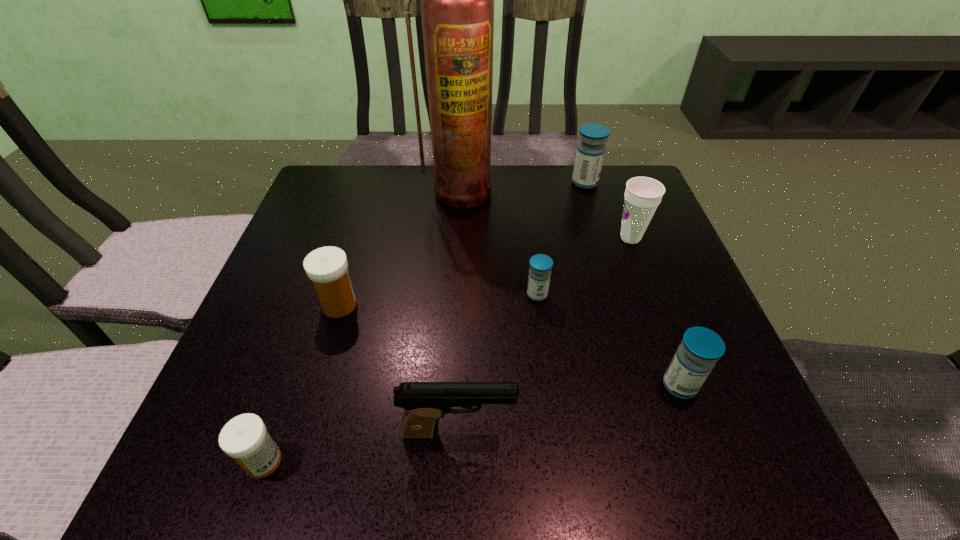
Where is `free spot at the far edge of the desktop`? This screenshot has width=960, height=540. free spot at the far edge of the desktop is located at coordinates (519, 185).

In order to click on free space at the near edge of the desktop in this screenshot , I will do [459, 434].

Locate an element on the screen. free space at the left edge of the desktop is located at coordinates (291, 408).

What are the coordinates of `blank space at the right edge` in the screenshot? It's located at (621, 222).

Identify the location of vacant space at the far left corner. The image size is (960, 540). (308, 213).

In the image, there is a desktop. Where is `vacant region at the near left corner`? vacant region at the near left corner is located at coordinates (193, 478).

Image resolution: width=960 pixels, height=540 pixels. I want to click on free space at the far right corner of the desktop, so click(615, 174).

Where is `free space at the near right corner of the desktop`? free space at the near right corner of the desktop is located at coordinates (733, 460).

Find the location of a particular element. vacant area that lies between the pistol and the farther white medicine is located at coordinates (398, 368).

The height and width of the screenshot is (540, 960). I want to click on vacant point located between the sixth nearest object and the pistol, so click(x=544, y=335).